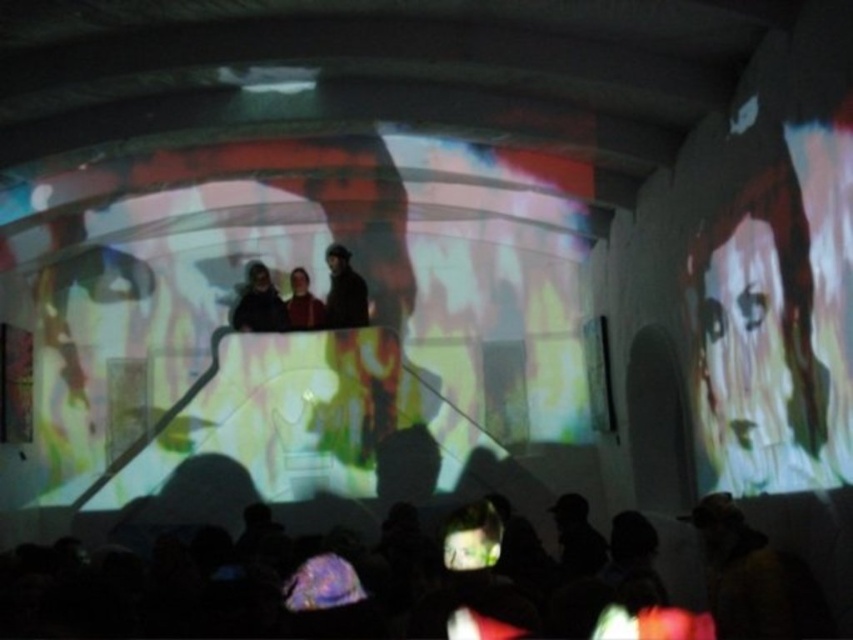
Based on the photo, you are a photographer trying to capture a closeup of the dark brown leather jacket at center and the matte black jacket at center during the presentation. Since the lighting is dim, you need to adjust your camera settings. Which jacket would require a smaller aperture to avoid overexposure?

The dark brown leather jacket at center is smaller than the matte black jacket at center, so it would require a smaller aperture to avoid overexposure.

You are standing in a dark room where a presentation is happening. There is a point at coordinates point (583, 470). If you want to move closer to this point, which direction should you move in relation to your current position?

The point (583, 470) is 11.02 meters away from the camera. To move closer to it, you should move forward towards the point (583, 470).

In the scene shown: You are an event organizer who needs to adjust the seating arrangement. You want to place a new chair between the translucent fabric screen at center and the dark brown leather jacket at center. Based on their positions, which object should the chair be closer to?

The chair should be placed closer to the dark brown leather jacket at center because the translucent fabric screen at center is to the left of the dark brown leather jacket at center, meaning the jacket is on the right side. Therefore, placing the chair between them would require positioning it nearer to the jacket to maintain balance.